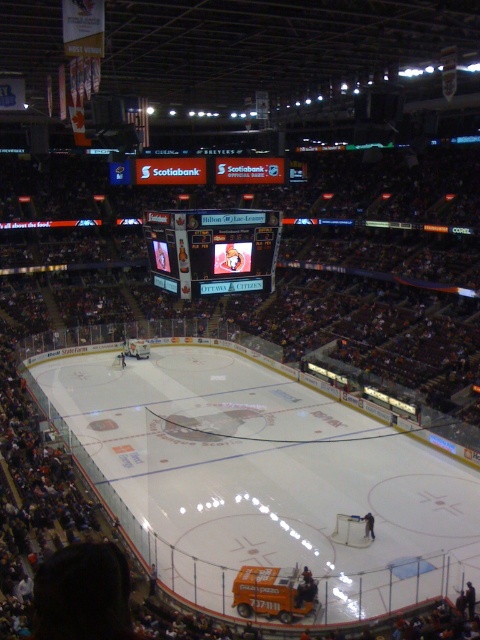
You are a spectator at the hockey game and want to watch the players skate on the white smooth ice at center. Where should you look relative to the shiny digital display at center?

The white smooth ice at center is located below the shiny digital display at center, so you should look below the shiny digital display at center to see the players skate.

Looking at this image, you are a hockey player standing at the boards near the small orange vehicle parked near the boards. You want to skate to the white smooth ice at center. Which direction should you move in?

Since the white smooth ice at center is located at coordinates approximately 0.745 on the x and 0.542 on the y axis, you should move towards the center of the arena from your current position near the boards and the small orange vehicle parked near the boards.